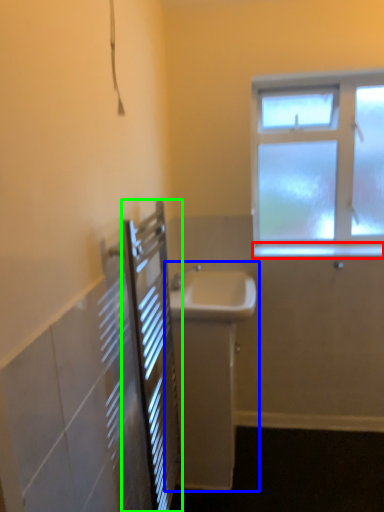
Question: Based on their relative distances, which object is nearer to window sill (highlighted by a red box)? Choose from sink (highlighted by a blue box) and screen door (highlighted by a green box).

Choices:
 (A) sink
 (B) screen door

Answer: (A)